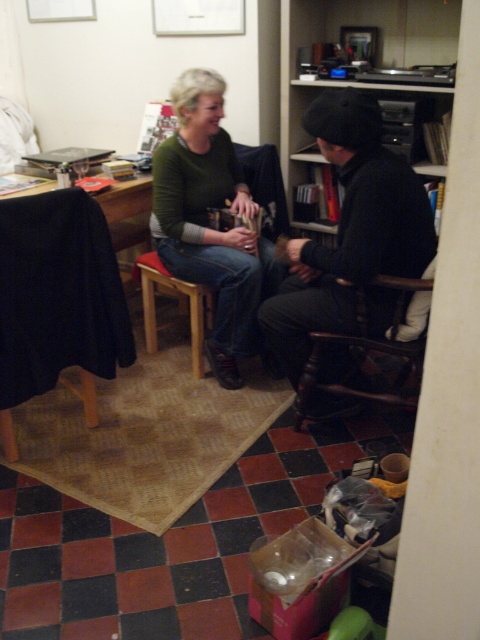
Does point (358, 172) come closer to viewer compared to point (242, 323)?

Yes, it is in front of point (242, 323).

Image resolution: width=480 pixels, height=640 pixels. Identify the location of dark woolen hat at center. (350, 234).

Who is more forward, [344,176] or [123,236]?

Point [344,176] is more forward.

Who is positioned more to the right, dark woolen hat at center or black fabric-covered table at left?

Positioned to the right is dark woolen hat at center.

The image size is (480, 640). I want to click on dark woolen hat at center, so click(x=350, y=234).

Between wooden bookshelf at upper center and black fabric-covered table at left, which one appears on the right side from the viewer's perspective?

wooden bookshelf at upper center

Does wooden bookshelf at upper center have a smaller size compared to black fabric-covered table at left?

Actually, wooden bookshelf at upper center might be larger than black fabric-covered table at left.

Where is `wooden bookshelf at upper center`? This screenshot has width=480, height=640. wooden bookshelf at upper center is located at coordinates click(376, 56).